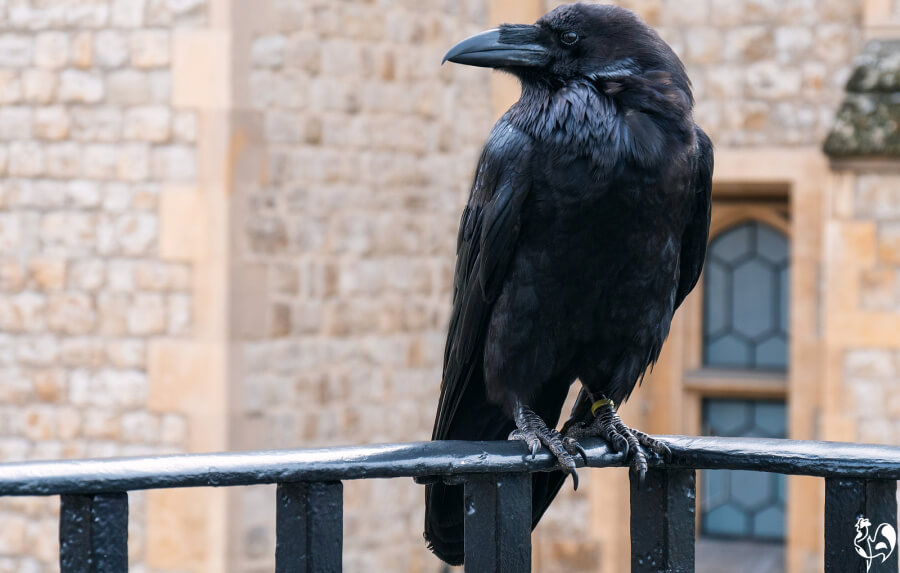
Identify the location of brick walls. (100, 179), (311, 203), (734, 88).